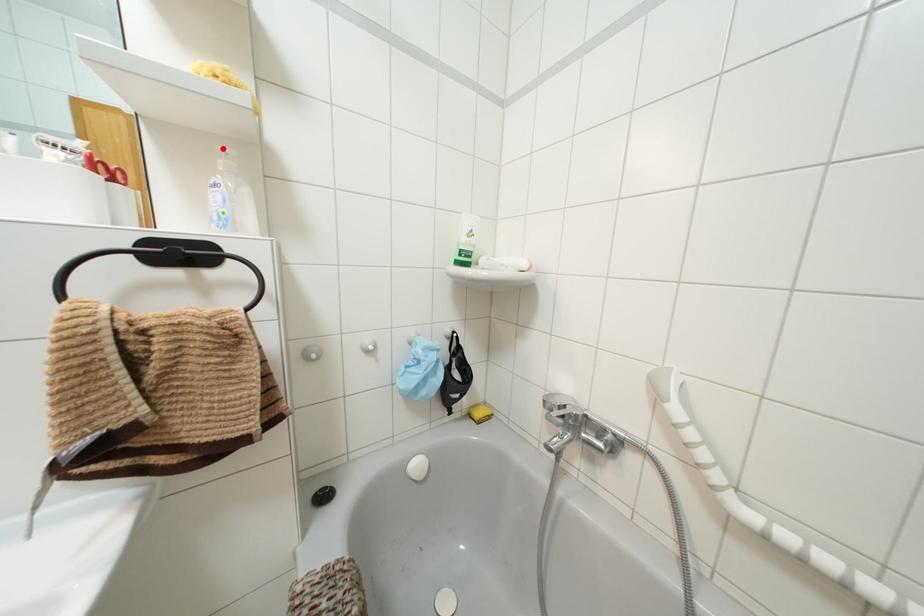
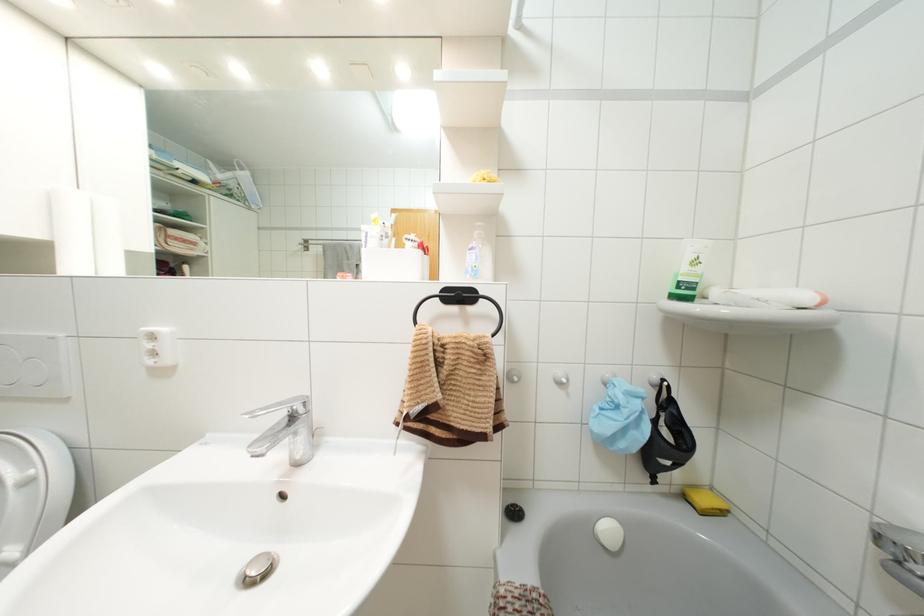
Where in the second image is the point corresponding to the highlighted location from the first image?

(479, 223)